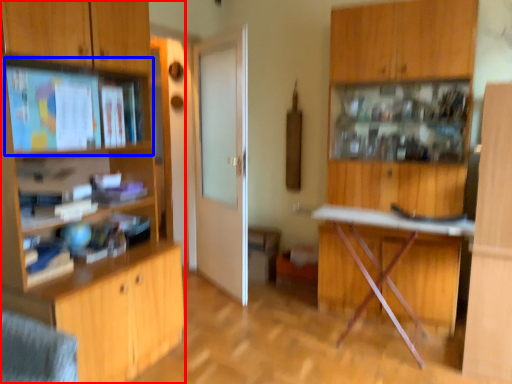
Question: Among these objects, which one is nearest to the camera, cabinetry (highlighted by a red box) or shelf (highlighted by a blue box)?

Choices:
 (A) cabinetry
 (B) shelf

Answer: (A)